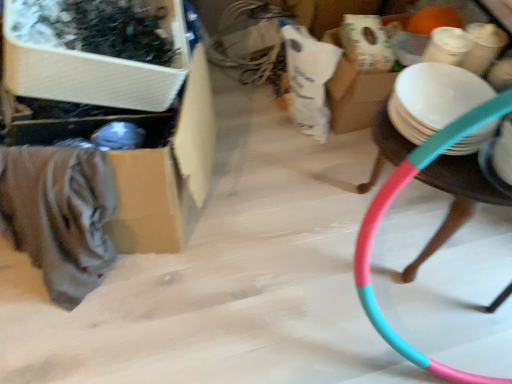
Locate an element on the screen. This screenshot has width=512, height=384. vacant space situated on the left part of pink plastic hoop at right is located at coordinates (272, 208).